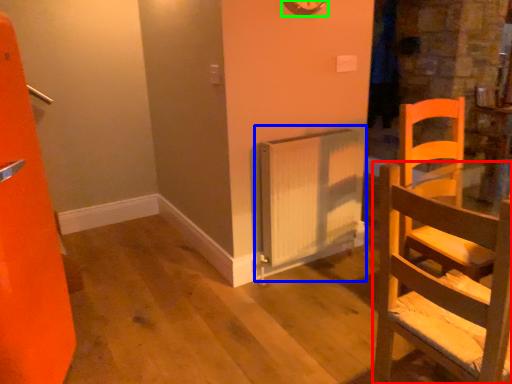
Question: Which object is positioned farthest from chair (highlighted by a red box)? Select from radiator (highlighted by a blue box) and clock (highlighted by a green box).

Choices:
 (A) radiator
 (B) clock

Answer: (B)